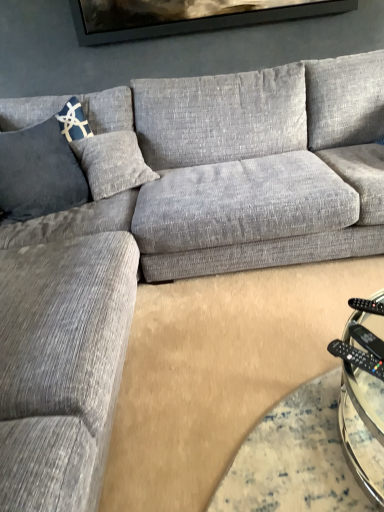
Question: Looking at their shapes, would you say black plastic remote at lower right, arranged as the first remote when viewed from the back, is wider or thinner than black plastic remote at lower right, which is the first remote from bottom to top?

Choices:
 (A) wide
 (B) thin

Answer: (A)

Question: Considering the positions of black plastic remote at lower right, the second remote positioned from the bottom, and black plastic remote at lower right, which is counted as the first remote, starting from the front, in the image, is black plastic remote at lower right, the second remote positioned from the bottom, taller or shorter than black plastic remote at lower right, which is counted as the first remote, starting from the front,?

Choices:
 (A) tall
 (B) short

Answer: (B)

Question: Which object is positioned closest to the black plastic remote at lower right?

Choices:
 (A) black plastic remote at lower right, which is counted as the 2th remote, starting from the back
 (B) black plastic remote at lower right, which ranks as the 2th remote in front-to-back order
 (C) blue textured pillow at left

Answer: (A)

Question: Which is farther from the black plastic remote at lower right, which is counted as the 2th remote, starting from the back?

Choices:
 (A) black plastic remote at lower right, which ranks as the 2th remote in front-to-back order
 (B) black plastic remote at lower right
 (C) blue textured pillow at left

Answer: (C)